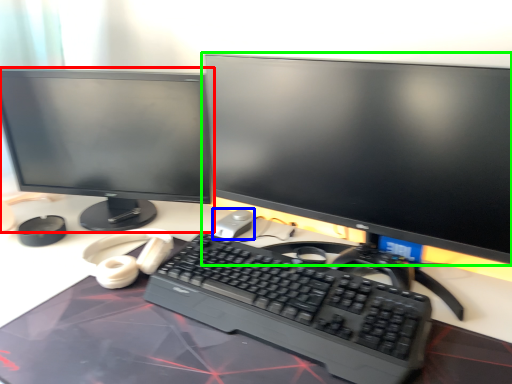
Question: Considering the real-world distances, which object is closest to computer monitor (highlighted by a red box)? mouse (highlighted by a blue box) or computer monitor (highlighted by a green box).

Choices:
 (A) mouse
 (B) computer monitor

Answer: (B)